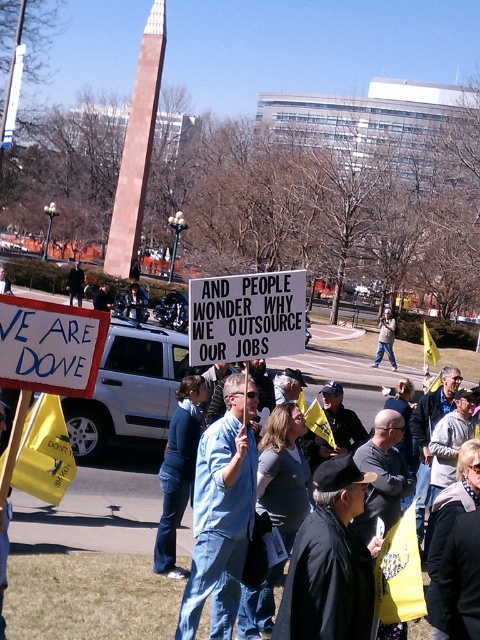
You are a photographer trying to capture a clear shot of both the white paper sign at center and the denim jacket at center. Based on their positions, which object should you adjust your camera angle to focus on first to ensure both are in frame?

The white paper sign at center is positioned on the left side of denim jacket at center. To capture both in frame, focus on the denim jacket at center first since it is on the right, allowing the sign to naturally fall into the left side of the frame.

You are a photographer at the protest scene. You want to capture a photo of the white cardboard sign at center and the denim jacket at center such that both are clearly visible. Considering their heights, which object should you focus on first to ensure both are in frame?

The white cardboard sign at center has a lesser height compared to the denim jacket at center, so you should focus on the denim jacket at center first to ensure both are in frame.

You are a photographer at the protest scene. You want to capture the white cardboard sign at center in your photo. The camera you are using has a field of view that covers up to 0.6 units vertically and 0.6 units horizontally. Given the sign is located at coordinate point 0.541, 0.104, will the sign be fully visible in your photo?

The white cardboard sign at center is located at coordinate point (49,346). The camera field of view covers up to 0.6 units vertically and 0.6 units horizontally. Since both coordinates are within the 0.6 range, the sign will be fully visible in the photo.